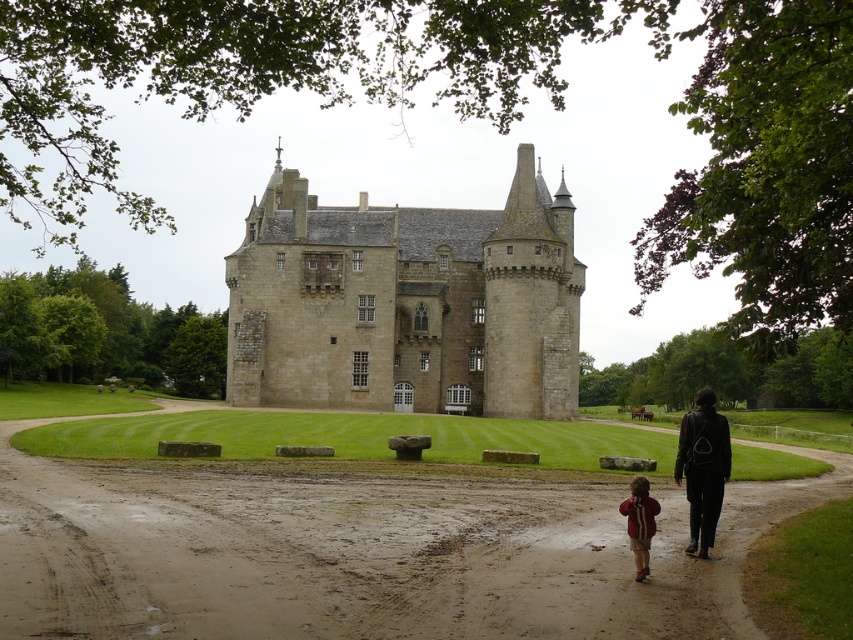
Between brown dirt track at center and black leather jacket at lower right, which one appears on the right side from the viewer's perspective?

black leather jacket at lower right

What do you see at coordinates (363, 552) in the screenshot? I see `brown dirt track at center` at bounding box center [363, 552].

This screenshot has width=853, height=640. What are the coordinates of `brown dirt track at center` in the screenshot? It's located at (363, 552).

Is beige stone castle at center smaller than red fleece jacket at lower right?

No, beige stone castle at center is not smaller than red fleece jacket at lower right.

Does beige stone castle at center have a lesser width compared to red fleece jacket at lower right?

Incorrect, beige stone castle at center's width is not less than red fleece jacket at lower right's.

Find the location of a particular element. The image size is (853, 640). beige stone castle at center is located at coordinates (407, 304).

Image resolution: width=853 pixels, height=640 pixels. Find the location of `beige stone castle at center`. beige stone castle at center is located at coordinates (407, 304).

Who is lower down, brown dirt track at center or red fleece jacket at lower right?

Positioned lower is brown dirt track at center.

Does brown dirt track at center lie in front of red fleece jacket at lower right?

Yes, brown dirt track at center is in front of red fleece jacket at lower right.

The height and width of the screenshot is (640, 853). In order to click on brown dirt track at center in this screenshot , I will do `click(363, 552)`.